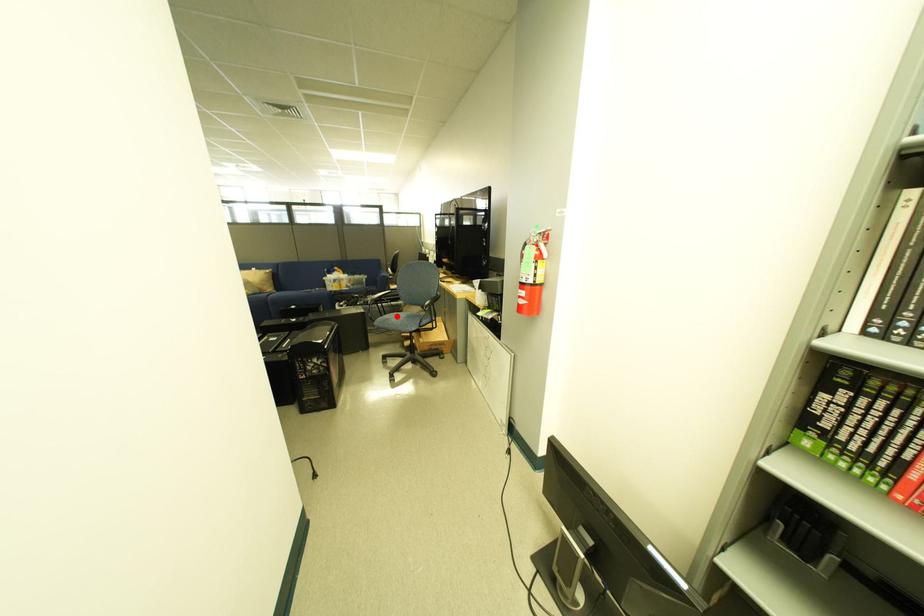
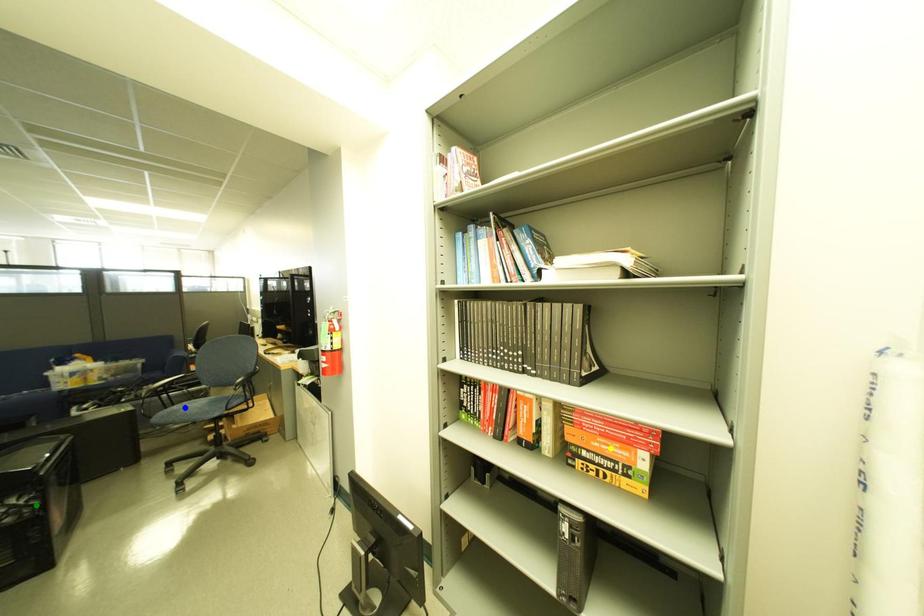
Question: I am providing you with two images of the same scene from different viewpoints. A red point is marked on the first image. You are given multiple points on the second image. Which mark in image 2 goes with the point in image 1?

Choices:
 (A) yellow point
 (B) green point
 (C) blue point

Answer: (C)